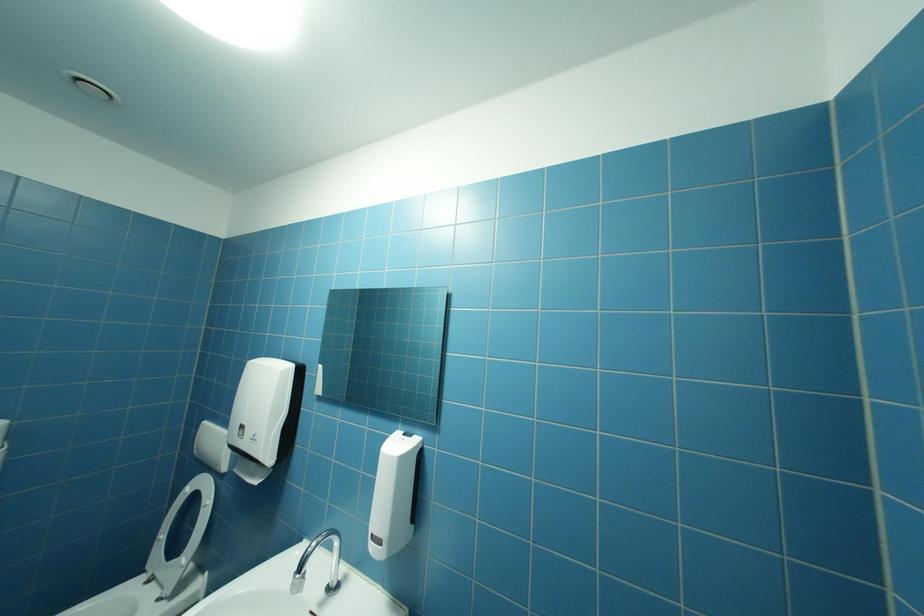
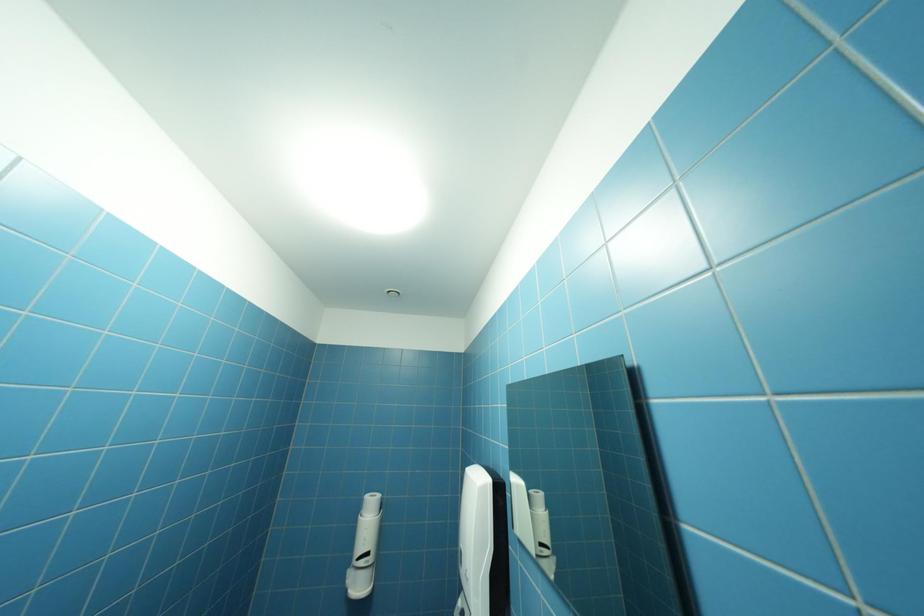
How did the camera likely rotate?

The rotation direction of the camera is left-up.